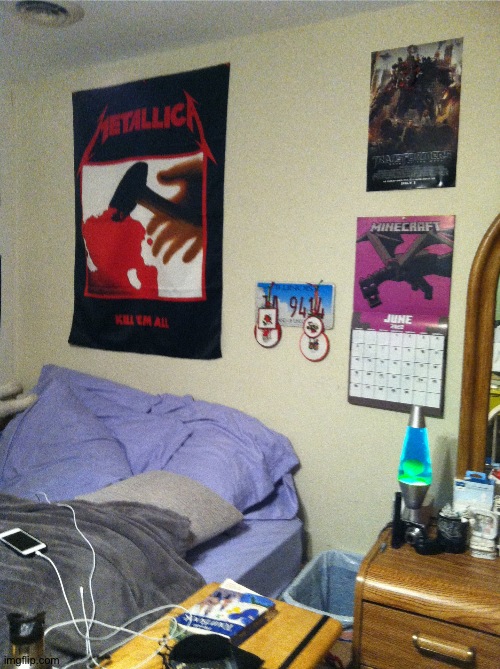
Locate an element on the screen. dresser is located at coordinates (425, 585).